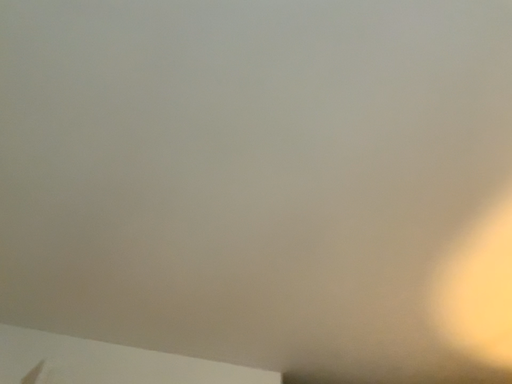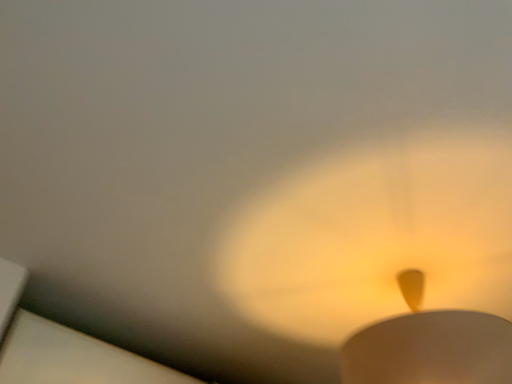
Question: Which way did the camera rotate in the video?

Choices:
 (A) rotated downward
 (B) rotated upward

Answer: (A)